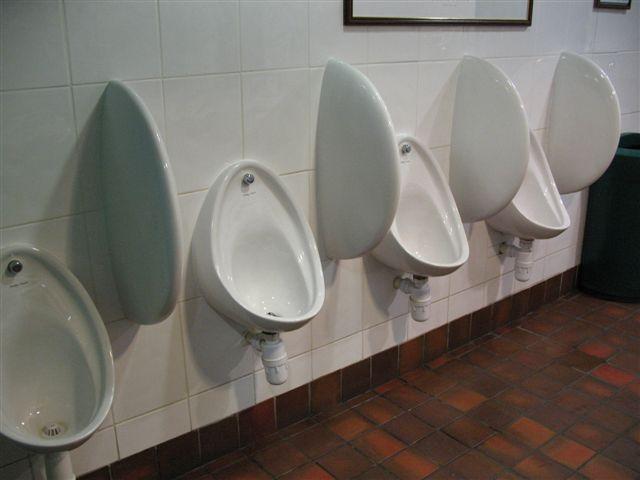
The image size is (640, 480). Find the location of `flush buttons`. flush buttons is located at coordinates (12, 265), (253, 177), (404, 148).